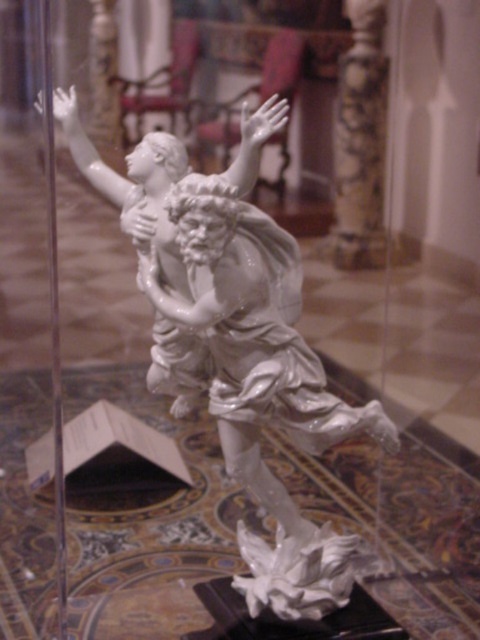
Consider the image. You are a photographer standing 1.06 meters away from the white glossy statue at center. You want to take a closeup shot of the statue without getting too close. Is your current distance sufficient to capture the statue in detail?

The distance between you and the white glossy statue at center is exactly 1.06 meters. Whether this is sufficient for a closeup depends on your camera equipment, but since the question doesn

Based on the photo, you are an art conservator examining the display case containing the white glossy statue at center and the white marble column at center. You need to determine if the statue can be moved to a storage shelf that can only accommodate items up to the width of the column. Can the statue fit based on their widths?

The white glossy statue at center is wider than the white marble column at center, so it cannot fit on the storage shelf designed for the column width.